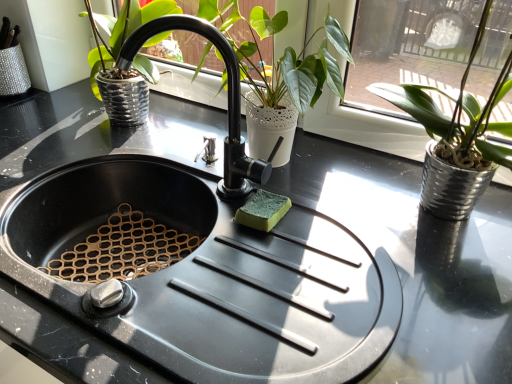
Question: Does black matte faucet at center appear on the right side of white textured pot at center, acting as the 2th houseplant starting from the right?

Choices:
 (A) no
 (B) yes

Answer: (A)

Question: From a real-world perspective, is black matte faucet at center located higher than white textured pot at center, acting as the 2th houseplant starting from the right?

Choices:
 (A) yes
 (B) no

Answer: (A)

Question: Considering the relative sizes of black matte faucet at center and white textured pot at center, acting as the 2th houseplant starting from the right, in the image provided, is black matte faucet at center thinner than white textured pot at center, acting as the 2th houseplant starting from the right,?

Choices:
 (A) no
 (B) yes

Answer: (B)

Question: From the image's perspective, is black matte faucet at center on white textured pot at center, which is the first houseplant in left-to-right order?

Choices:
 (A) yes
 (B) no

Answer: (B)

Question: Is black matte faucet at center positioned far away from white textured pot at center, acting as the 2th houseplant starting from the right?

Choices:
 (A) no
 (B) yes

Answer: (A)

Question: In terms of width, does silver metallic pot at right, the first houseplant from the right, look wider or thinner when compared to black matte faucet at center?

Choices:
 (A) thin
 (B) wide

Answer: (B)

Question: Is silver metallic pot at right, the first houseplant from the right, spatially inside black matte faucet at center, or outside of it?

Choices:
 (A) outside
 (B) inside

Answer: (A)

Question: Considering the relative positions of silver metallic pot at right, arranged as the 2th houseplant when viewed from the left, and black matte faucet at center in the image provided, is silver metallic pot at right, arranged as the 2th houseplant when viewed from the left, to the left or to the right of black matte faucet at center?

Choices:
 (A) left
 (B) right

Answer: (B)

Question: From the image's perspective, is silver metallic pot at right, arranged as the 2th houseplant when viewed from the left, above or below black matte faucet at center?

Choices:
 (A) below
 (B) above

Answer: (B)

Question: Based on their sizes in the image, would you say white textured pot at center, which is the first houseplant in left-to-right order, is bigger or smaller than black matte faucet at center?

Choices:
 (A) small
 (B) big

Answer: (B)

Question: From the image's perspective, is white textured pot at center, which is the first houseplant in left-to-right order, above or below black matte faucet at center?

Choices:
 (A) above
 (B) below

Answer: (A)

Question: Considering the relative positions of white textured pot at center, acting as the 2th houseplant starting from the right, and black matte faucet at center in the image provided, is white textured pot at center, acting as the 2th houseplant starting from the right, to the left or to the right of black matte faucet at center?

Choices:
 (A) right
 (B) left

Answer: (A)

Question: Looking at their shapes, would you say white textured pot at center, which is the first houseplant in left-to-right order, is wider or thinner than black matte faucet at center?

Choices:
 (A) wide
 (B) thin

Answer: (A)

Question: From the image's perspective, is black matte faucet at center positioned above or below white textured pot at center, which is the first houseplant in left-to-right order?

Choices:
 (A) above
 (B) below

Answer: (B)

Question: Relative to white textured pot at center, acting as the 2th houseplant starting from the right, is black matte faucet at center in front or behind?

Choices:
 (A) behind
 (B) front

Answer: (B)